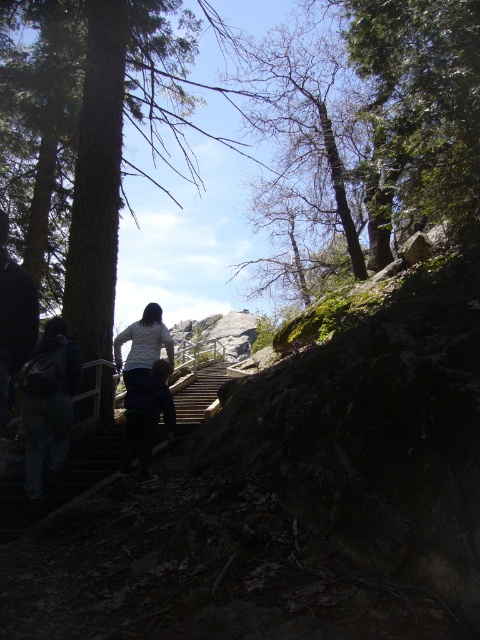
You are a hiker who needs to reach the top of the wooden stairs at lower left. The green textured tree at upper left is blocking your path. Can you walk around the tree to reach the stairs?

The green textured tree at upper left is 10.78 meters away from the wooden stairs at lower left, so you can walk around the tree to reach the wooden stairs at lower left as there is enough space between them.

You are hiking up the wooden stairs at lower left and want to take a photo of the green textured tree at upper left. Which direction should you face to capture it in your shot?

To capture the green textured tree at upper left in your photo while standing on the wooden stairs at lower left, you should face to the left since the green textured tree at upper left is positioned to the left of the wooden stairs at lower left.